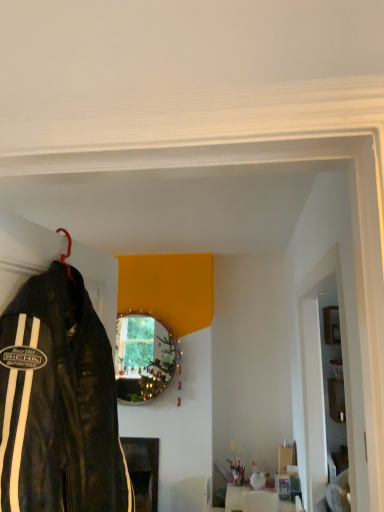
Question: Is white glossy door at right to the left of white glossy vase at center, which appears as the second furniture when viewed from the left, from the viewer's perspective?

Choices:
 (A) yes
 (B) no

Answer: (B)

Question: Is white glossy door at right positioned with its back to white glossy vase at center, which is the 1th furniture from right to left?

Choices:
 (A) no
 (B) yes

Answer: (A)

Question: Considering the relative sizes of white glossy door at right and white glossy vase at center, which appears as the second furniture when viewed from the left, in the image provided, is white glossy door at right shorter than white glossy vase at center, which appears as the second furniture when viewed from the left,?

Choices:
 (A) no
 (B) yes

Answer: (A)

Question: From the image's perspective, is white glossy door at right above white glossy vase at center, acting as the first furniture starting from the front?

Choices:
 (A) no
 (B) yes

Answer: (B)

Question: Is white glossy door at right positioned beyond the bounds of white glossy vase at center, which is the 1th furniture from right to left?

Choices:
 (A) yes
 (B) no

Answer: (A)

Question: Based on their sizes in the image, would you say metallic dark brown fireplace at lower center, acting as the second furniture starting from the front, is bigger or smaller than white glossy door at right?

Choices:
 (A) small
 (B) big

Answer: (A)

Question: Is metallic dark brown fireplace at lower center, acting as the second furniture starting from the front, in front of or behind white glossy door at right in the image?

Choices:
 (A) front
 (B) behind

Answer: (B)

Question: Is metallic dark brown fireplace at lower center, which is the first furniture in back-to-front order, inside the boundaries of white glossy door at right, or outside?

Choices:
 (A) inside
 (B) outside

Answer: (B)

Question: From the image's perspective, relative to white glossy door at right, is metallic dark brown fireplace at lower center, which is the first furniture in back-to-front order, above or below?

Choices:
 (A) above
 (B) below

Answer: (B)

Question: In terms of height, does black leather jacket at left look taller or shorter compared to white glossy door at right?

Choices:
 (A) short
 (B) tall

Answer: (A)

Question: Considering the positions of point (99, 323) and point (311, 422), is point (99, 323) closer or farther from the camera than point (311, 422)?

Choices:
 (A) closer
 (B) farther

Answer: (A)

Question: Considering the positions of black leather jacket at left and white glossy door at right in the image, is black leather jacket at left wider or thinner than white glossy door at right?

Choices:
 (A) thin
 (B) wide

Answer: (B)

Question: In the image, is black leather jacket at left positioned in front of or behind white glossy door at right?

Choices:
 (A) front
 (B) behind

Answer: (A)

Question: Considering the positions of point (132, 458) and point (226, 504), is point (132, 458) closer or farther from the camera than point (226, 504)?

Choices:
 (A) closer
 (B) farther

Answer: (B)

Question: In the image, is metallic dark brown fireplace at lower center, acting as the second furniture starting from the front, on the left side or the right side of white glossy vase at center, the second furniture in the back-to-front sequence?

Choices:
 (A) left
 (B) right

Answer: (A)